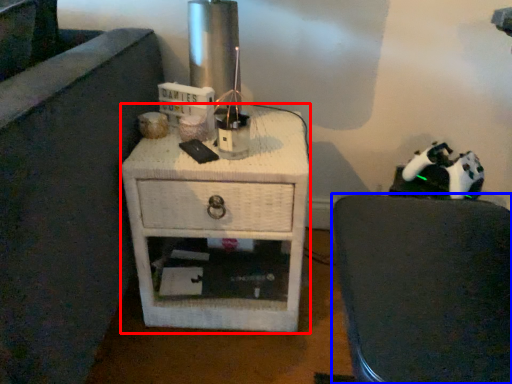
Question: Which of the following is the closest to the observer, nightstand (highlighted by a red box) or furniture (highlighted by a blue box)?

Choices:
 (A) nightstand
 (B) furniture

Answer: (B)